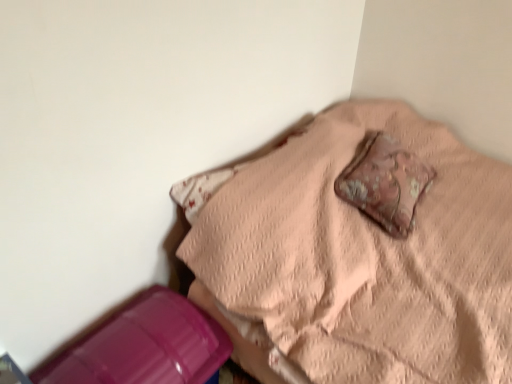
Question: Could pink quilted bedspread at upper center be considered to be inside rusty fabric pillow at center?

Choices:
 (A) no
 (B) yes

Answer: (A)

Question: Is rusty fabric pillow at center in front of pink quilted bedspread at upper center?

Choices:
 (A) yes
 (B) no

Answer: (B)

Question: From a real-world perspective, is rusty fabric pillow at center physically above pink quilted bedspread at upper center?

Choices:
 (A) yes
 (B) no

Answer: (A)

Question: Considering the relative positions of rusty fabric pillow at center and pink quilted bedspread at upper center in the image provided, is rusty fabric pillow at center to the right of pink quilted bedspread at upper center from the viewer's perspective?

Choices:
 (A) yes
 (B) no

Answer: (A)

Question: From the image's perspective, is rusty fabric pillow at center above pink quilted bedspread at upper center?

Choices:
 (A) yes
 (B) no

Answer: (A)

Question: Could you tell me if rusty fabric pillow at center is turned towards pink quilted bedspread at upper center?

Choices:
 (A) yes
 (B) no

Answer: (A)

Question: Are pink quilted bedspread at upper center and rusty fabric pillow at center beside each other?

Choices:
 (A) yes
 (B) no

Answer: (B)

Question: Is pink quilted bedspread at upper center thinner than rusty fabric pillow at center?

Choices:
 (A) no
 (B) yes

Answer: (A)

Question: Is pink quilted bedspread at upper center to the right of rusty fabric pillow at center from the viewer's perspective?

Choices:
 (A) no
 (B) yes

Answer: (A)

Question: Is the depth of pink quilted bedspread at upper center less than that of rusty fabric pillow at center?

Choices:
 (A) no
 (B) yes

Answer: (B)

Question: Are pink quilted bedspread at upper center and rusty fabric pillow at center far apart?

Choices:
 (A) no
 (B) yes

Answer: (A)

Question: From a real-world perspective, is pink quilted bedspread at upper center positioned over rusty fabric pillow at center based on gravity?

Choices:
 (A) yes
 (B) no

Answer: (B)

Question: Is pink quilted bedspread at upper center to the left or to the right of rusty fabric pillow at center in the image?

Choices:
 (A) right
 (B) left

Answer: (B)